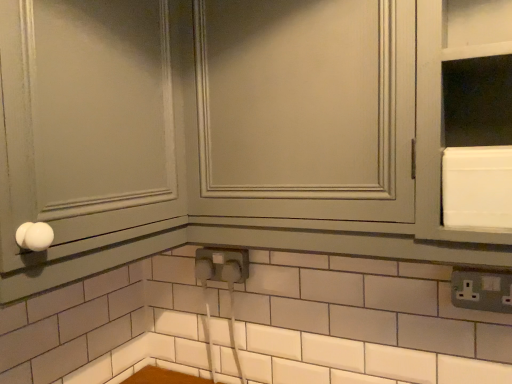
Question: From the image's perspective, is white glossy cabinet at center above or below white glossy knob at left?

Choices:
 (A) below
 (B) above

Answer: (A)

Question: Is point (295, 99) closer or farther from the camera than point (68, 33)?

Choices:
 (A) closer
 (B) farther

Answer: (B)

Question: Which is farther from the white glossy knob at left?

Choices:
 (A) white glossy cabinet at center
 (B) gray plastic electrical outlet at lower right

Answer: (B)

Question: Which object is positioned farthest from the gray plastic electrical outlet at lower right?

Choices:
 (A) white glossy knob at left
 (B) white glossy cabinet at center

Answer: (A)